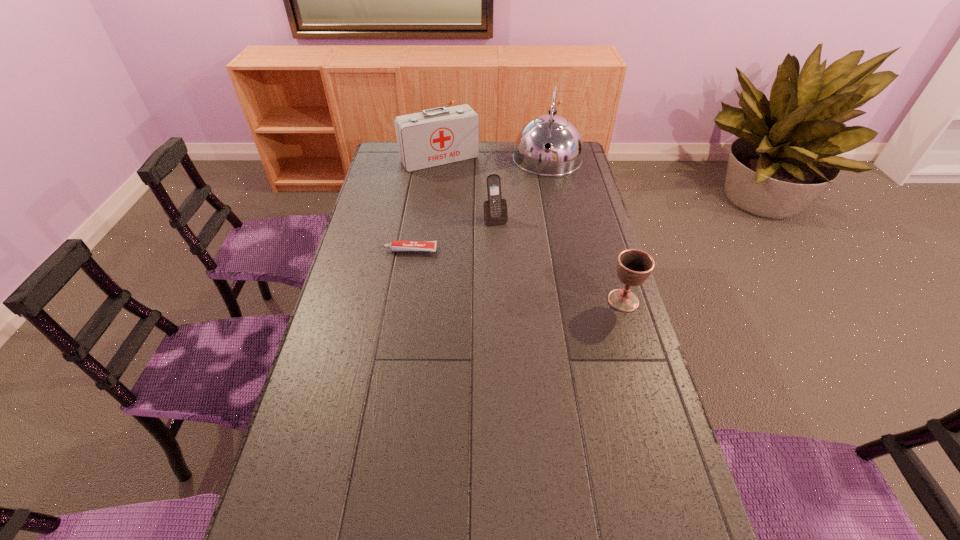
Where is `vacant space positioned on the front-facing side of the first-aid kit`? This screenshot has width=960, height=540. vacant space positioned on the front-facing side of the first-aid kit is located at coordinates (487, 219).

Locate an element on the screen. The width and height of the screenshot is (960, 540). vacant space located 0.100m on the front-facing side of the first-aid kit is located at coordinates (462, 184).

Locate an element on the screen. The image size is (960, 540). free spot located 0.120m on the front-facing side of the cellular telephone is located at coordinates (505, 247).

I want to click on vacant space located on the front-facing side of the cellular telephone, so click(x=505, y=247).

Locate an element on the screen. Image resolution: width=960 pixels, height=540 pixels. vacant region located on the front-facing side of the cellular telephone is located at coordinates (502, 238).

Find the location of `free spot located 0.150m from the spout of the kettle`. free spot located 0.150m from the spout of the kettle is located at coordinates (541, 201).

Image resolution: width=960 pixels, height=540 pixels. Find the location of `free space located from the spout of the kettle`. free space located from the spout of the kettle is located at coordinates (540, 211).

Locate an element on the screen. free point located from the spout of the kettle is located at coordinates (538, 231).

In order to click on the first-aid kit situated at the far edge in this screenshot , I will do `click(438, 136)`.

You are a GUI agent. You are given a task and a screenshot of the screen. Output one action in this format:
    pyautogui.click(x=<x>, y=<y>)
    Task: Click on the kettle that is at the far edge
    
    Given the screenshot: What is the action you would take?
    pyautogui.click(x=564, y=155)